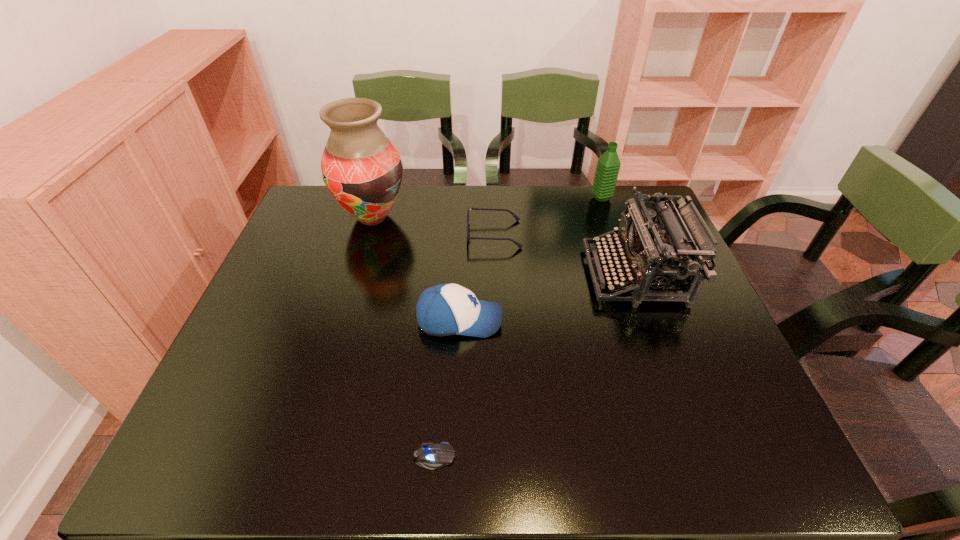
You are a GUI agent. You are given a task and a screenshot of the screen. Output one action in this format:
    pyautogui.click(x=<x>, y=<y>)
    Task: Click on the free spot between the fourth tallest object and the computer mouse
    Image resolution: width=960 pixels, height=540 pixels.
    Given the screenshot: What is the action you would take?
    pyautogui.click(x=446, y=388)

I want to click on free space between the vase and the baseball cap, so click(416, 268).

Locate an element on the screen. free spot between the typewriter and the vase is located at coordinates (503, 246).

Where is `free space between the water bottle and the vase`? free space between the water bottle and the vase is located at coordinates (487, 207).

Select which object is the second closest to the water bottle. Please provide its 2D coordinates. Your answer should be formatted as a tuple, i.e. [(x, y)], where the tuple contains the x and y coordinates of a point satisfying the conditions above.

[(516, 217)]

Locate an element on the screen. Image resolution: width=960 pixels, height=540 pixels. the closest object to the third shortest object is located at coordinates (516, 217).